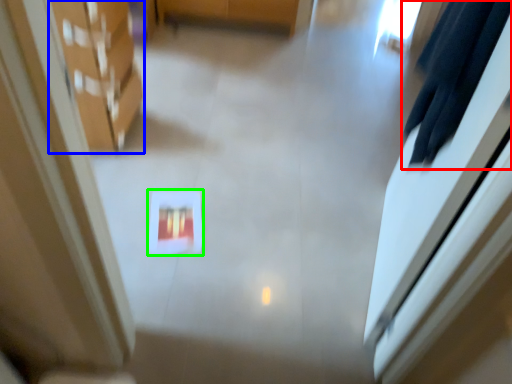
Question: Which object is the closest to the robe (highlighted by a red box)? Choose among these: furniture (highlighted by a blue box) or square (highlighted by a green box).

Choices:
 (A) furniture
 (B) square

Answer: (B)